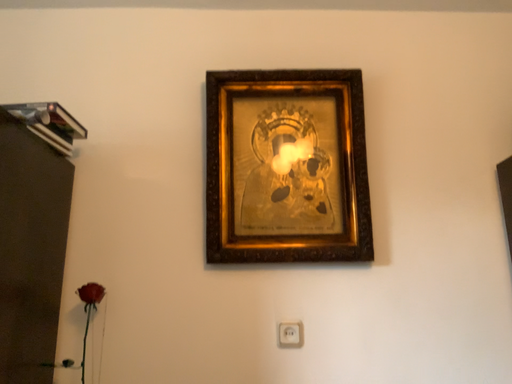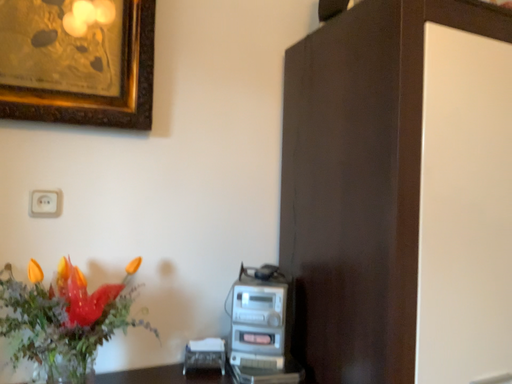
Question: Which way did the camera rotate in the video?

Choices:
 (A) rotated downward
 (B) rotated upward

Answer: (A)